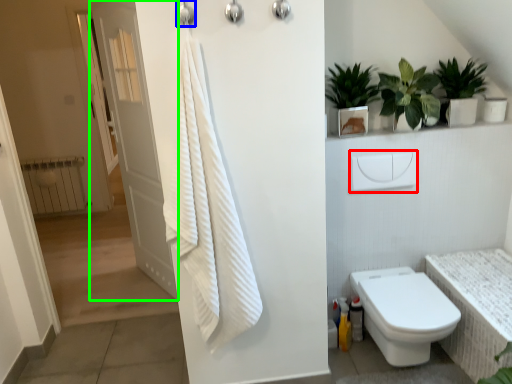
Question: Estimate the real-world distances between objects in this image. Which object is farther from towel bar (highlighted by a red box), shower (highlighted by a blue box) or door (highlighted by a green box)?

Choices:
 (A) shower
 (B) door

Answer: (B)